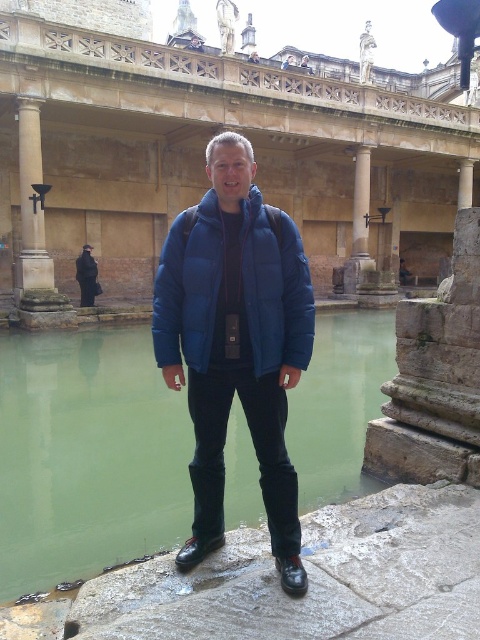
You are a tour guide explaining the Roman Baths to a group. You mention the matte stone palace at center and the green stone pool at center. Which one is wider?

The matte stone palace at center is wider than the green stone pool at center.

You are a fashion designer observing a man wearing two jackets in front of the Roman Baths. Which jacket, the blue puffy jacket at center or the matte blue jacket at center, is bigger?

The blue puffy jacket at center is larger in size compared to the matte blue jacket at center.